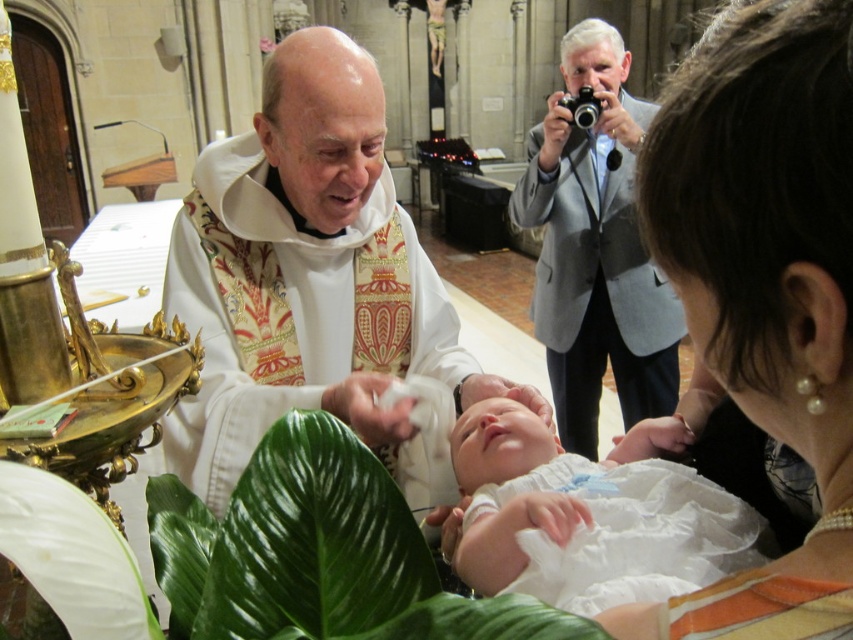
You are an interior designer planning to place a new decorative item in the church scene. The item must fit between the white clothed newborn at center and the gray fabric jacket at upper right. Given their widths, which object should the item be placed next to to ensure it doesn

The white clothed newborn at center has a lesser width compared to gray fabric jacket at upper right. Therefore, the decorative item should be placed next to the gray fabric jacket at upper right to accommodate its size.

You are standing in the church and need to place a small decoration exactly at the center of the white silk vestment at center. According to the image, where should you place it?

The 2D location of the white silk vestment at center is at point (306, 275), so you should place the decoration at those coordinates.

You are an interior designer observing the church scene. You need to place a small decoration between the pearl earrings at upper right and the white silk vestment at center. Which object should the decoration be closer to based on their heights?

The pearl earrings at upper right has a lesser height compared to white silk vestment at center, so the decoration should be placed closer to the pearl earrings at upper right since it is shorter.